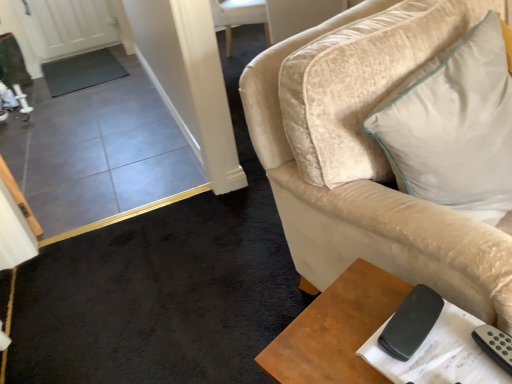
Question: Is white soft cushion at upper right bigger or smaller than brown wooden table at lower right?

Choices:
 (A) big
 (B) small

Answer: (A)

Question: Considering the positions of white soft cushion at upper right and brown wooden table at lower right in the image, is white soft cushion at upper right taller or shorter than brown wooden table at lower right?

Choices:
 (A) tall
 (B) short

Answer: (B)

Question: Which is nearer to the black matte remote at lower right?

Choices:
 (A) white soft cushion at upper right
 (B) brown wooden table at lower right

Answer: (B)

Question: Which object is positioned closest to the brown wooden table at lower right?

Choices:
 (A) white soft cushion at upper right
 (B) black matte remote at lower right

Answer: (B)